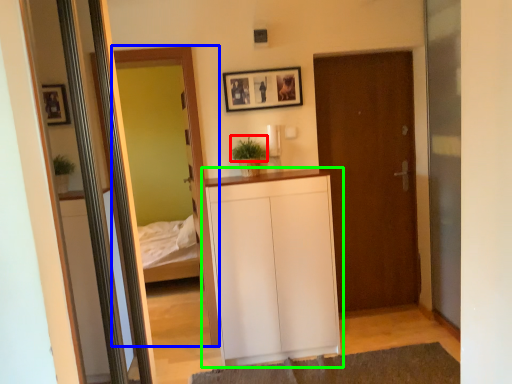
Question: Considering the real-world distances, which object is farthest from plant (highlighted by a red box)? mirror (highlighted by a blue box) or cabinetry (highlighted by a green box)?

Choices:
 (A) mirror
 (B) cabinetry

Answer: (B)